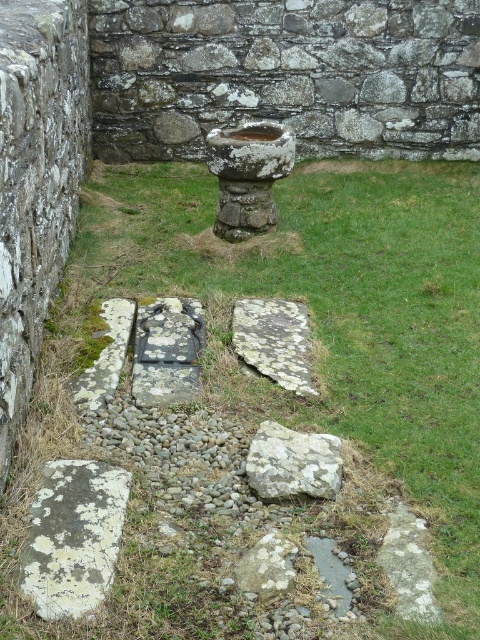
At what (x,y) coordinates should I click in order to perform the action: click on speckled stone at center. Please return your answer as a coordinate pair (x, y). This screenshot has height=640, width=480. Looking at the image, I should click on (274, 340).

Is point (236, 307) more distant than point (260, 564)?

That is True.

Identify the location of speckled stone at center. (274, 340).

Looking at this image, is lichen-covered stone at lower left thinner than green mossy stone at lower left?

Incorrect, lichen-covered stone at lower left's width is not less than green mossy stone at lower left's.

Does lichen-covered stone at lower left have a greater height compared to green mossy stone at lower left?

Incorrect, lichen-covered stone at lower left's height is not larger of green mossy stone at lower left's.

Between point (120, 531) and point (76, 378), which one is positioned in front?

Point (120, 531) is more forward.

Identify the location of lichen-covered stone at lower left. (73, 536).

Does speckled rock at center appear under lichen-covered rock at center?

No, speckled rock at center is not below lichen-covered rock at center.

Looking at this image, does speckled rock at center have a smaller size compared to lichen-covered rock at center?

No, speckled rock at center is not smaller than lichen-covered rock at center.

Between point (271, 452) and point (290, 554), which one is positioned behind?

The point (271, 452) is more distant.

Locate an element on the screen. The image size is (480, 640). speckled rock at center is located at coordinates (292, 464).